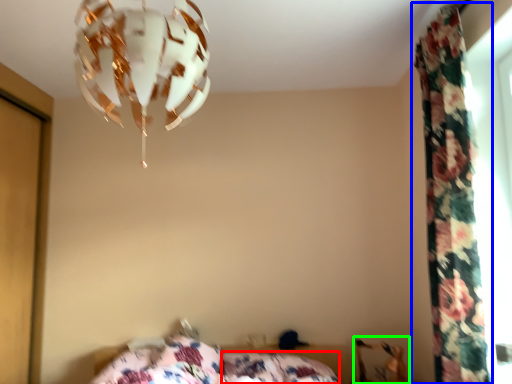
Question: Based on their relative distances, which object is farther from pillow (highlighted by a red box)? Choose from curtain (highlighted by a blue box) and swivel chair (highlighted by a green box).

Choices:
 (A) curtain
 (B) swivel chair

Answer: (A)